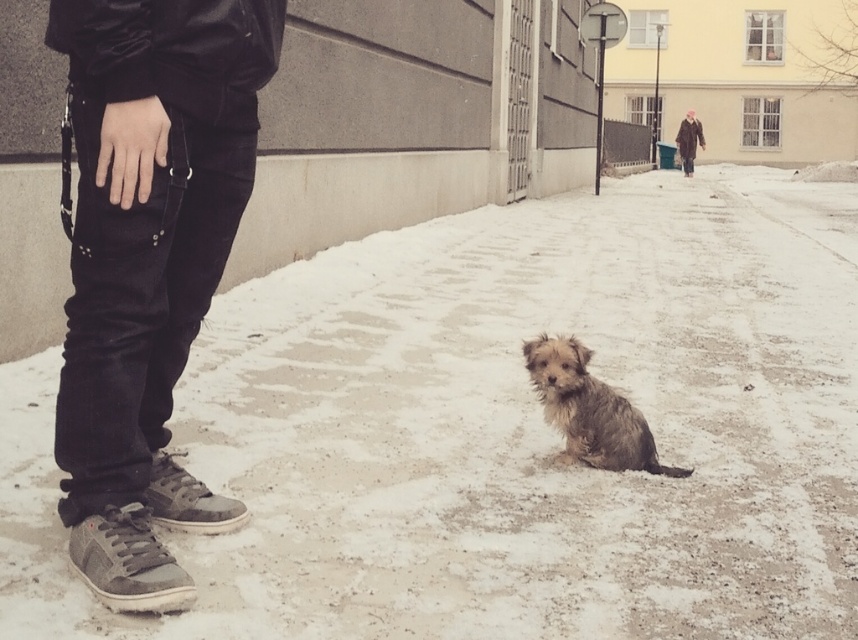
You are standing on the sidewalk in the winter scene. You see a point marked at coordinates (x=505, y=429). What is located at that point?

The point at coordinates (x=505, y=429) corresponds to white powdery snow at lower center.

You are a pedestrian trying to avoid stepping on the snow. Which object, the black leather pants at lower left or the fuzzy brown dog at center, is closer to the left side of the path?

The black leather pants at lower left are closer to the left side of the path because they are positioned to the left of the fuzzy brown dog at center.